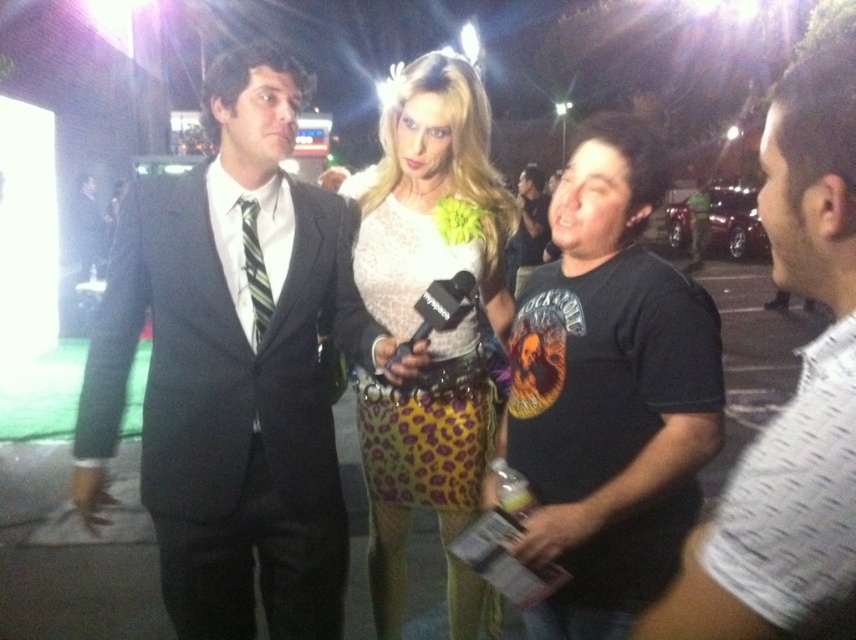
Is matte black suit at left below black cotton t-shirt at center?

Yes.

Who is positioned more to the left, matte black suit at left or black cotton t-shirt at center?

matte black suit at left is more to the left.

Between point (150, 460) and point (578, 464), which one is positioned behind?

The point (150, 460) is behind.

At what (x,y) coordinates should I click in order to perform the action: click on matte black suit at left. Please return your answer as a coordinate pair (x, y). Looking at the image, I should click on (233, 368).

Can you confirm if lace fabric top at center is positioned below white textured shirt at right?

Actually, lace fabric top at center is above white textured shirt at right.

Does lace fabric top at center lie behind white textured shirt at right?

Yes, it is.

Locate an element on the screen. lace fabric top at center is located at coordinates (431, 195).

At what (x,y) coordinates should I click in order to perform the action: click on lace fabric top at center. Please return your answer as a coordinate pair (x, y). This screenshot has width=856, height=640. Looking at the image, I should click on (431, 195).

Does point (480, 250) come behind point (474, 218)?

Yes, point (480, 250) is behind point (474, 218).

Which of these two, lace fabric top at center or lace fabric dress at center, stands taller?

lace fabric dress at center

Describe the element at coordinates (431, 195) in the screenshot. The image size is (856, 640). I see `lace fabric top at center` at that location.

Where is `lace fabric top at center`? The image size is (856, 640). lace fabric top at center is located at coordinates (431, 195).